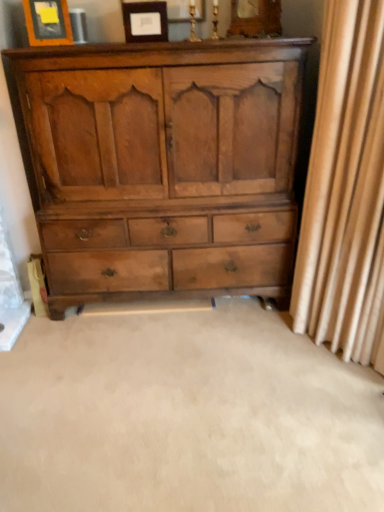
Measure the distance between matte wood picture frame at upper center, which is the 2th picture frame in left-to-right order, and camera.

The depth of matte wood picture frame at upper center, which is the 2th picture frame in left-to-right order, is 1.87 meters.

What do you see at coordinates (47, 22) in the screenshot? Image resolution: width=384 pixels, height=512 pixels. I see `matte wood picture frame at upper left, marked as the second picture frame in a right-to-left arrangement` at bounding box center [47, 22].

Measure the distance between point (157, 266) and camera.

2.37 meters.

What do you see at coordinates (345, 191) in the screenshot?
I see `beige fabric curtain at right` at bounding box center [345, 191].

At what (x,y) coordinates should I click in order to perform the action: click on beige fabric curtain at right. Please return your answer as a coordinate pair (x, y). The height and width of the screenshot is (512, 384). Looking at the image, I should click on (345, 191).

Where is `matte wood picture frame at upper center, which is the 2th picture frame in left-to-right order`? This screenshot has height=512, width=384. matte wood picture frame at upper center, which is the 2th picture frame in left-to-right order is located at coordinates (145, 21).

Based on the photo, are light brown wood chest of drawers at center and beige fabric curtain at right located far from each other?

light brown wood chest of drawers at center is actually quite close to beige fabric curtain at right.

Does light brown wood chest of drawers at center have a larger size compared to beige fabric curtain at right?

Correct, light brown wood chest of drawers at center is larger in size than beige fabric curtain at right.

From the image's perspective, is light brown wood chest of drawers at center under beige fabric curtain at right?

No, from the image's perspective, light brown wood chest of drawers at center is not beneath beige fabric curtain at right.

Looking at this image, measure the distance from light brown wood chest of drawers at center to beige fabric curtain at right.

light brown wood chest of drawers at center is 63.02 centimeters from beige fabric curtain at right.

Which of these two, beige fabric curtain at right or matte wood picture frame at upper center, placed as the 1th picture frame when sorted from right to left, is thinner?

With smaller width is matte wood picture frame at upper center, placed as the 1th picture frame when sorted from right to left.

Between point (353, 354) and point (165, 4), which one is positioned behind?

Positioned behind is point (353, 354).

Find the location of a particular element. The height and width of the screenshot is (512, 384). the 2nd picture frame behind the beige fabric curtain at right, starting your count from the anchor is located at coordinates (145, 21).

Is matte wood picture frame at upper center, placed as the 1th picture frame when sorted from right to left, to the left of matte wood picture frame at upper left, marked as the second picture frame in a right-to-left arrangement, from the viewer's perspective?

No.

Is matte wood picture frame at upper left, marked as the second picture frame in a right-to-left arrangement, completely or partially inside matte wood picture frame at upper center, placed as the 1th picture frame when sorted from right to left?

No.

From a real-world perspective, is matte wood picture frame at upper center, which is the 2th picture frame in left-to-right order, positioned over matte wood picture frame at upper left, marked as the second picture frame in a right-to-left arrangement, based on gravity?

No, from a real-world perspective, matte wood picture frame at upper center, which is the 2th picture frame in left-to-right order, is not above matte wood picture frame at upper left, marked as the second picture frame in a right-to-left arrangement.

Who is shorter, matte wood picture frame at upper center, placed as the 1th picture frame when sorted from right to left, or matte wood picture frame at upper left, the first picture frame viewed from the left?

matte wood picture frame at upper center, placed as the 1th picture frame when sorted from right to left.

Is light brown wood chest of drawers at center facing away from matte wood picture frame at upper center, which is the 2th picture frame in left-to-right order?

That's not correct — light brown wood chest of drawers at center is not looking away from matte wood picture frame at upper center, which is the 2th picture frame in left-to-right order.

From the image's perspective, which object appears higher, light brown wood chest of drawers at center or matte wood picture frame at upper center, placed as the 1th picture frame when sorted from right to left?

matte wood picture frame at upper center, placed as the 1th picture frame when sorted from right to left, appears higher in the image.

Which of these two, light brown wood chest of drawers at center or matte wood picture frame at upper center, which is the 2th picture frame in left-to-right order, stands shorter?

matte wood picture frame at upper center, which is the 2th picture frame in left-to-right order, is shorter.

Based on their positions, is light brown wood chest of drawers at center located to the left or right of matte wood picture frame at upper center, which is the 2th picture frame in left-to-right order?

Based on their positions, light brown wood chest of drawers at center is located to the right of matte wood picture frame at upper center, which is the 2th picture frame in left-to-right order.

Between light brown wood chest of drawers at center and matte wood picture frame at upper left, the first picture frame viewed from the left, which one has larger size?

light brown wood chest of drawers at center is bigger.

Considering the relative positions of light brown wood chest of drawers at center and matte wood picture frame at upper left, marked as the second picture frame in a right-to-left arrangement, in the image provided, is light brown wood chest of drawers at center to the right of matte wood picture frame at upper left, marked as the second picture frame in a right-to-left arrangement, from the viewer's perspective?

Correct, you'll find light brown wood chest of drawers at center to the right of matte wood picture frame at upper left, marked as the second picture frame in a right-to-left arrangement.

Considering the positions of point (102, 154) and point (43, 35), is point (102, 154) closer or farther from the camera than point (43, 35)?

Point (102, 154) is positioned farther from the camera compared to point (43, 35).

Is light brown wood chest of drawers at center wider than matte wood picture frame at upper left, the first picture frame viewed from the left?

Yes, light brown wood chest of drawers at center is wider than matte wood picture frame at upper left, the first picture frame viewed from the left.

Considering their positions, is matte wood picture frame at upper left, marked as the second picture frame in a right-to-left arrangement, located in front of or behind matte wood picture frame at upper center, placed as the 1th picture frame when sorted from right to left?

matte wood picture frame at upper left, marked as the second picture frame in a right-to-left arrangement, is positioned closer to the viewer than matte wood picture frame at upper center, placed as the 1th picture frame when sorted from right to left.

Does matte wood picture frame at upper left, marked as the second picture frame in a right-to-left arrangement, touch matte wood picture frame at upper center, which is the 2th picture frame in left-to-right order?

No, matte wood picture frame at upper left, marked as the second picture frame in a right-to-left arrangement, is not in contact with matte wood picture frame at upper center, which is the 2th picture frame in left-to-right order.

From the image's perspective, is matte wood picture frame at upper left, marked as the second picture frame in a right-to-left arrangement, located above matte wood picture frame at upper center, placed as the 1th picture frame when sorted from right to left?

Incorrect, from the image's perspective, matte wood picture frame at upper left, marked as the second picture frame in a right-to-left arrangement, is lower than matte wood picture frame at upper center, placed as the 1th picture frame when sorted from right to left.

Can you tell me how much beige fabric curtain at right and light brown wood chest of drawers at center differ in facing direction?

The angle between the facing direction of beige fabric curtain at right and the facing direction of light brown wood chest of drawers at center is 47.3 degrees.

Does beige fabric curtain at right turn towards light brown wood chest of drawers at center?

No, beige fabric curtain at right is not turned towards light brown wood chest of drawers at center.

Based on the photo, considering the relative sizes of beige fabric curtain at right and light brown wood chest of drawers at center in the image provided, is beige fabric curtain at right wider than light brown wood chest of drawers at center?

No, beige fabric curtain at right is not wider than light brown wood chest of drawers at center.

Locate an element on the screen. Image resolution: width=384 pixels, height=512 pixels. curtain in front of the light brown wood chest of drawers at center is located at coordinates (345, 191).

Find the location of a particular element. This screenshot has height=512, width=384. curtain directly beneath the matte wood picture frame at upper center, which is the 2th picture frame in left-to-right order (from a real-world perspective) is located at coordinates (345, 191).

Which object lies nearer to the anchor point light brown wood chest of drawers at center, matte wood picture frame at upper center, placed as the 1th picture frame when sorted from right to left, or matte wood picture frame at upper left, the first picture frame viewed from the left?

The object closer to light brown wood chest of drawers at center is matte wood picture frame at upper center, placed as the 1th picture frame when sorted from right to left.

In the scene shown: Estimate the real-world distances between objects in this image. Which object is closer to matte wood picture frame at upper center, placed as the 1th picture frame when sorted from right to left, matte wood picture frame at upper left, marked as the second picture frame in a right-to-left arrangement, or light brown wood chest of drawers at center?

Based on the image, matte wood picture frame at upper left, marked as the second picture frame in a right-to-left arrangement, appears to be nearer to matte wood picture frame at upper center, placed as the 1th picture frame when sorted from right to left.

When comparing their distances from matte wood picture frame at upper left, marked as the second picture frame in a right-to-left arrangement, does beige fabric curtain at right or matte wood picture frame at upper center, which is the 2th picture frame in left-to-right order, seem further?

Among the two, beige fabric curtain at right is located further to matte wood picture frame at upper left, marked as the second picture frame in a right-to-left arrangement.

Which object lies further to the anchor point light brown wood chest of drawers at center, matte wood picture frame at upper left, marked as the second picture frame in a right-to-left arrangement, or beige fabric curtain at right?

matte wood picture frame at upper left, marked as the second picture frame in a right-to-left arrangement.

Consider the image. Based on their spatial positions, is beige fabric curtain at right or matte wood picture frame at upper center, which is the 2th picture frame in left-to-right order, further from light brown wood chest of drawers at center?

Among the two, matte wood picture frame at upper center, which is the 2th picture frame in left-to-right order, is located further to light brown wood chest of drawers at center.

From the image, which object appears to be nearer to matte wood picture frame at upper left, the first picture frame viewed from the left, light brown wood chest of drawers at center or matte wood picture frame at upper center, which is the 2th picture frame in left-to-right order?

Among the two, matte wood picture frame at upper center, which is the 2th picture frame in left-to-right order, is located nearer to matte wood picture frame at upper left, the first picture frame viewed from the left.

Which object lies nearer to the anchor point beige fabric curtain at right, matte wood picture frame at upper left, marked as the second picture frame in a right-to-left arrangement, or matte wood picture frame at upper center, placed as the 1th picture frame when sorted from right to left?

matte wood picture frame at upper center, placed as the 1th picture frame when sorted from right to left, is positioned closer to the anchor beige fabric curtain at right.

Which object lies nearer to the anchor point matte wood picture frame at upper center, which is the 2th picture frame in left-to-right order, light brown wood chest of drawers at center or beige fabric curtain at right?

light brown wood chest of drawers at center is closer to matte wood picture frame at upper center, which is the 2th picture frame in left-to-right order.

This screenshot has width=384, height=512. In order to click on picture frame between matte wood picture frame at upper center, which is the 2th picture frame in left-to-right order, and light brown wood chest of drawers at center vertically in this screenshot , I will do `click(47, 22)`.

Locate an element on the screen. picture frame between matte wood picture frame at upper left, the first picture frame viewed from the left, and beige fabric curtain at right, in the horizontal direction is located at coordinates (145, 21).

Where is `the chest of drawers situated between matte wood picture frame at upper left, the first picture frame viewed from the left, and beige fabric curtain at right from left to right`? the chest of drawers situated between matte wood picture frame at upper left, the first picture frame viewed from the left, and beige fabric curtain at right from left to right is located at coordinates (164, 166).

Locate an element on the screen. the chest of drawers situated between matte wood picture frame at upper center, placed as the 1th picture frame when sorted from right to left, and beige fabric curtain at right from left to right is located at coordinates (164, 166).